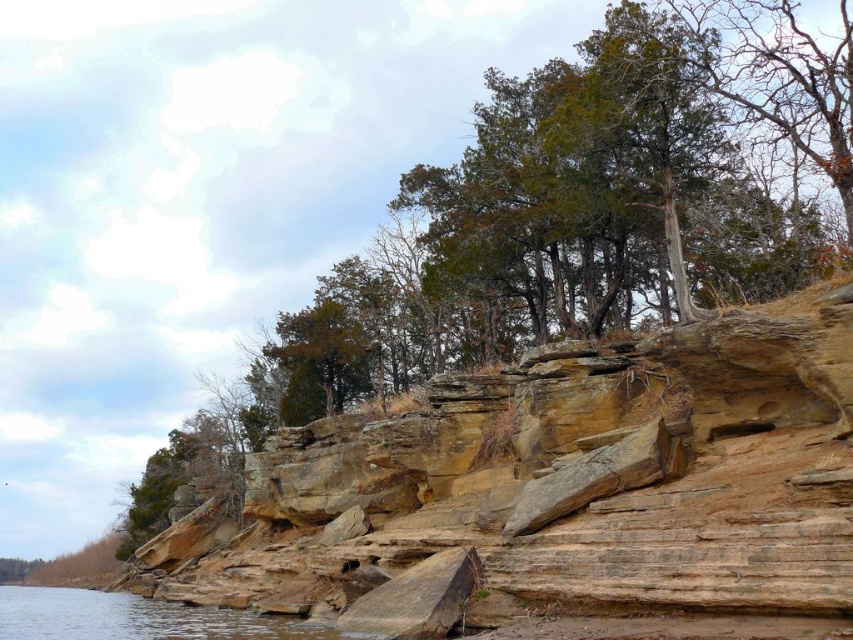
Question: Can you confirm if yellowish-brown rock at center is bigger than clear water at lower left?

Choices:
 (A) no
 (B) yes

Answer: (A)

Question: Can you confirm if yellowish-brown rock at center is thinner than clear water at lower left?

Choices:
 (A) no
 (B) yes

Answer: (B)

Question: Is yellowish-brown rock at center to the right of clear water at lower left from the viewer's perspective?

Choices:
 (A) yes
 (B) no

Answer: (A)